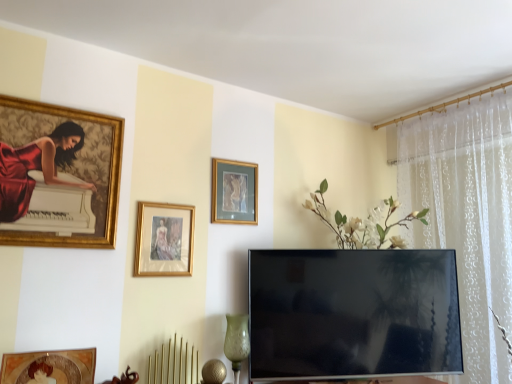
Question: Is gold-framed picture at center, which is the 1th picture frame from back to front, bigger or smaller than gold-framed painting at upper left, the third picture frame positioned from the back?

Choices:
 (A) big
 (B) small

Answer: (B)

Question: From the image's perspective, is gold-framed picture at center, the third picture frame viewed from the left, above or below gold-framed painting at upper left, which ranks as the first picture frame in front-to-back order?

Choices:
 (A) below
 (B) above

Answer: (A)

Question: Estimate the real-world distances between objects in this image. Which object is closer to the gold-framed picture at center, which is the 1th picture frame from back to front?

Choices:
 (A) flat screen tv at center
 (B) gold-framed picture at center, the 2th picture frame viewed from the front
 (C) gold-framed painting at upper left, the third picture frame positioned from the back
 (D) green textured glass vase at lower center

Answer: (B)

Question: Based on their relative distances, which object is nearer to the gold-framed picture at center, positioned as the 2th picture frame in back-to-front order?

Choices:
 (A) gold-framed picture at center, acting as the 3th picture frame starting from the front
 (B) gold-framed painting at upper left, the 1th picture frame in the left-to-right sequence
 (C) flat screen tv at center
 (D) green textured glass vase at lower center

Answer: (A)